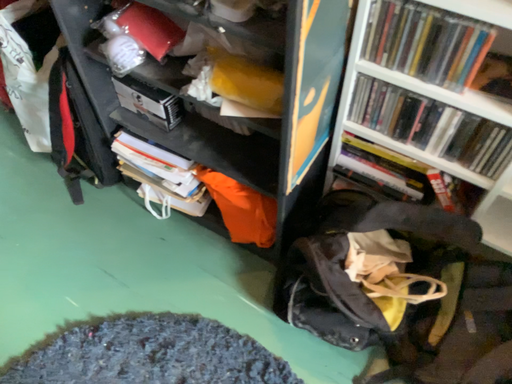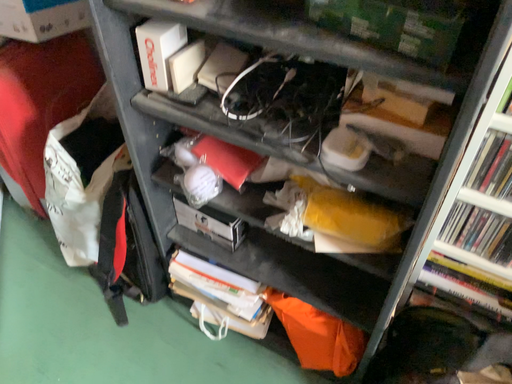
Question: Which way did the camera rotate in the video?

Choices:
 (A) rotated downward
 (B) rotated upward

Answer: (B)